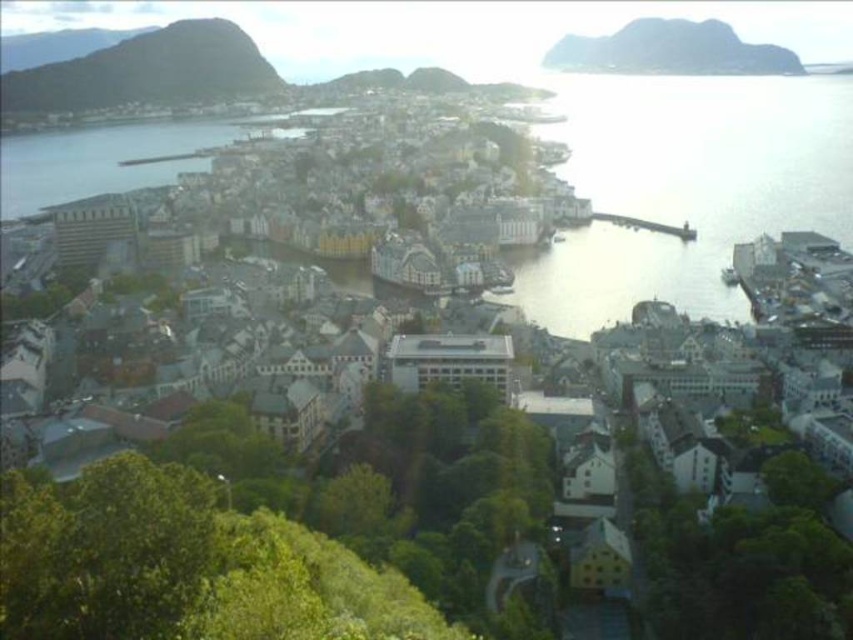
Is rugged brown rock at upper left to the left of rocky gray cliff at upper right from the viewer's perspective?

Indeed, rugged brown rock at upper left is positioned on the left side of rocky gray cliff at upper right.

Is point (223, 52) behind point (572, 49)?

That is False.

Describe the element at coordinates (148, 70) in the screenshot. Image resolution: width=853 pixels, height=640 pixels. I see `rugged brown rock at upper left` at that location.

Find the location of a particular element. This screenshot has width=853, height=640. rugged brown rock at upper left is located at coordinates (148, 70).

Measure the distance between clear water at lower right and camera.

clear water at lower right is 271.74 meters from camera.

Does clear water at lower right have a greater width compared to rugged brown rock at upper left?

Yes, clear water at lower right is wider than rugged brown rock at upper left.

Who is more distant from viewer, (630,99) or (15,109)?

Point (15,109)

This screenshot has width=853, height=640. I want to click on clear water at lower right, so click(x=683, y=186).

This screenshot has height=640, width=853. What do you see at coordinates (683, 186) in the screenshot?
I see `clear water at lower right` at bounding box center [683, 186].

Is point (785, 80) positioned before point (762, 65)?

No, (785, 80) is further to viewer.

Locate an element on the screen. The width and height of the screenshot is (853, 640). clear water at lower right is located at coordinates (683, 186).